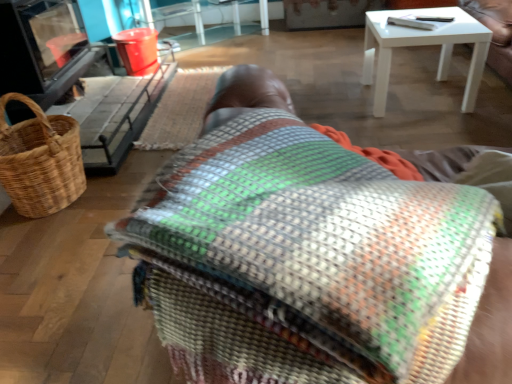
Find the location of a particular element. The width and height of the screenshot is (512, 384). vacant area on top of woven fabric mat at upper center (from a real-world perspective) is located at coordinates (184, 99).